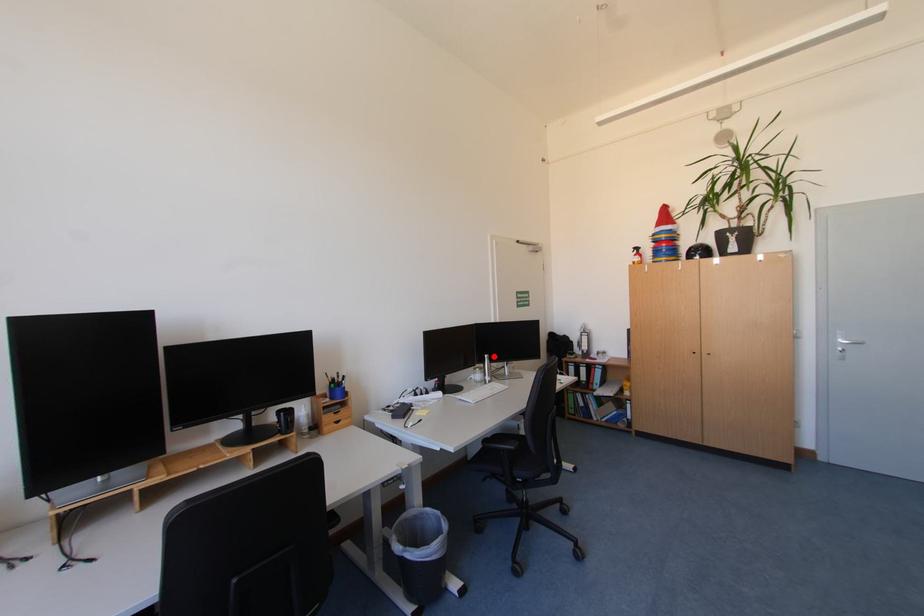
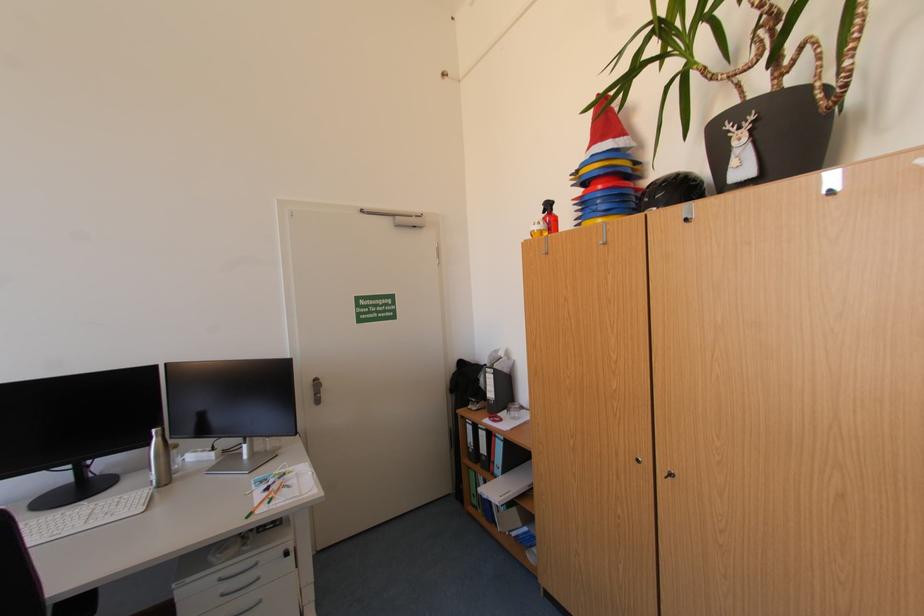
In the second image, find the point that corresponds to the highlighted location in the first image.

(161, 431)